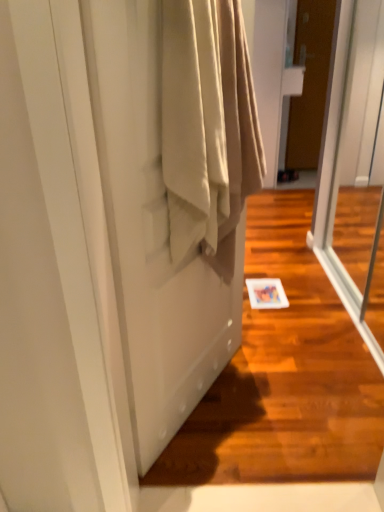
Locate an element on the screen. This screenshot has width=384, height=512. vacant area that is in front of satin beige curtain at lower left, arranged as the 2th screen door when viewed from the right is located at coordinates (219, 445).